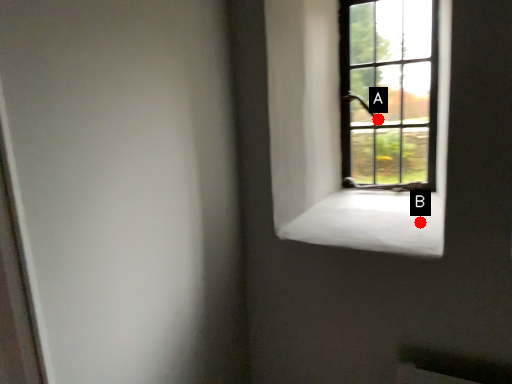
Question: Two points are circled on the image, labeled by A and B beside each circle. Which point is closer to the camera taking this photo?

Choices:
 (A) A is closer
 (B) B is closer

Answer: (B)